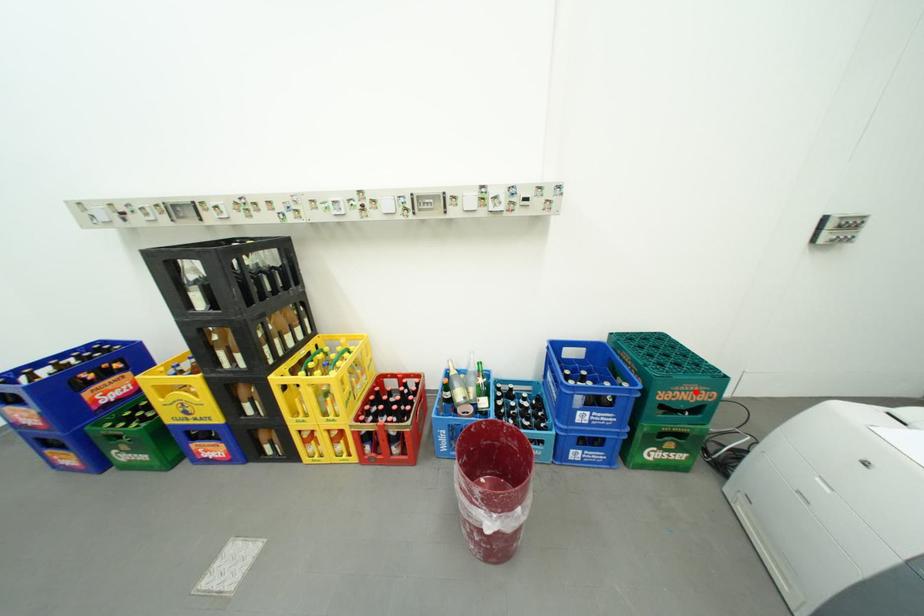
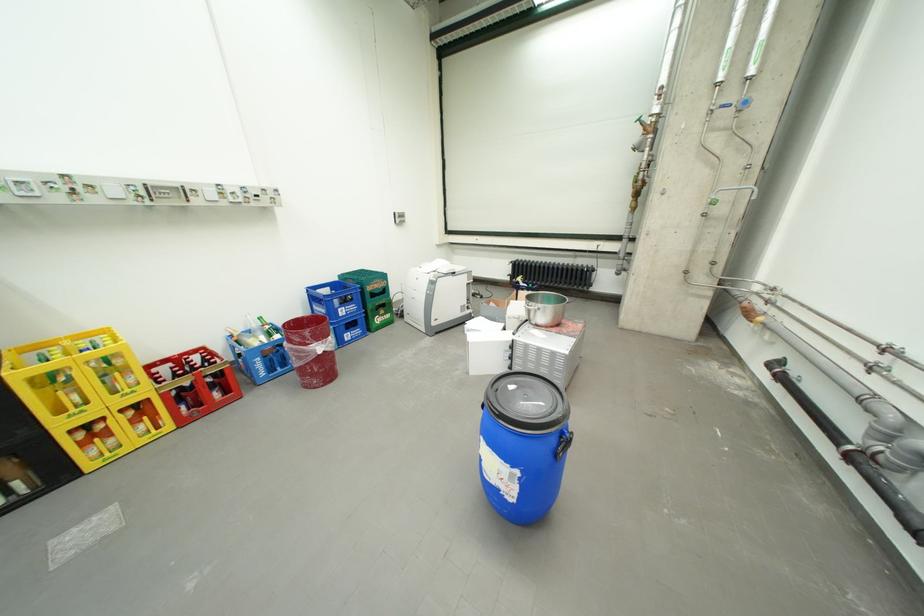
Question: I am providing you with two images of the same scene from different viewpoints. Given a red point in image1, look at the same physical point in image2. Is it:

Choices:
 (A) Closer to the viewpoint
 (B) Farther from the viewpoint

Answer: (A)